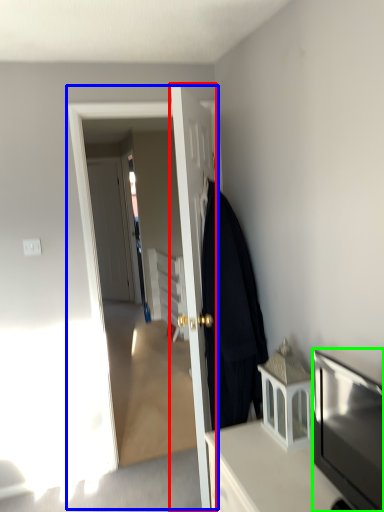
Question: Which is nearer to the door (highlighted by a red box)? screen door (highlighted by a blue box) or television (highlighted by a green box).

Choices:
 (A) screen door
 (B) television

Answer: (A)